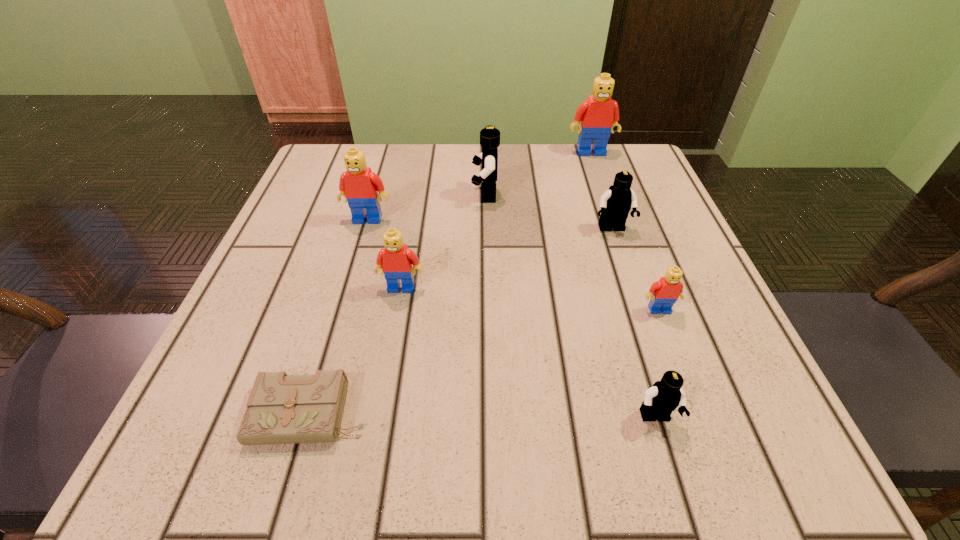
The width and height of the screenshot is (960, 540). In order to click on the biggest red Lego in this screenshot , I will do `click(598, 114)`.

Where is `the tallest object`? the tallest object is located at coordinates (598, 114).

At what (x,y) coordinates should I click in order to perform the action: click on the fifth object from right to left. Please return your answer as a coordinate pair (x, y). Looking at the image, I should click on (489, 136).

Find the location of a particular element. Image resolution: width=960 pixels, height=540 pixels. the leftmost black Lego is located at coordinates (489, 136).

You are a GUI agent. You are given a task and a screenshot of the screen. Output one action in this format:
    pyautogui.click(x=<x>, y=<y>)
    Task: Click on the leftmost Lego
    The image size is (960, 540).
    Given the screenshot: What is the action you would take?
    pyautogui.click(x=359, y=185)

Find the location of a particular element. The image size is (960, 540). the leftmost red Lego is located at coordinates (359, 185).

This screenshot has width=960, height=540. Find the location of `the third red Lego from right to left`. the third red Lego from right to left is located at coordinates (395, 260).

Image resolution: width=960 pixels, height=540 pixels. Find the location of `the second Lego from left to right`. the second Lego from left to right is located at coordinates (395, 260).

At what (x,y) coordinates should I click in order to perform the action: click on the second biggest black Lego. Please return your answer as a coordinate pair (x, y). The height and width of the screenshot is (540, 960). Looking at the image, I should click on (617, 201).

Where is `the second nearest Lego`? This screenshot has width=960, height=540. the second nearest Lego is located at coordinates (664, 293).